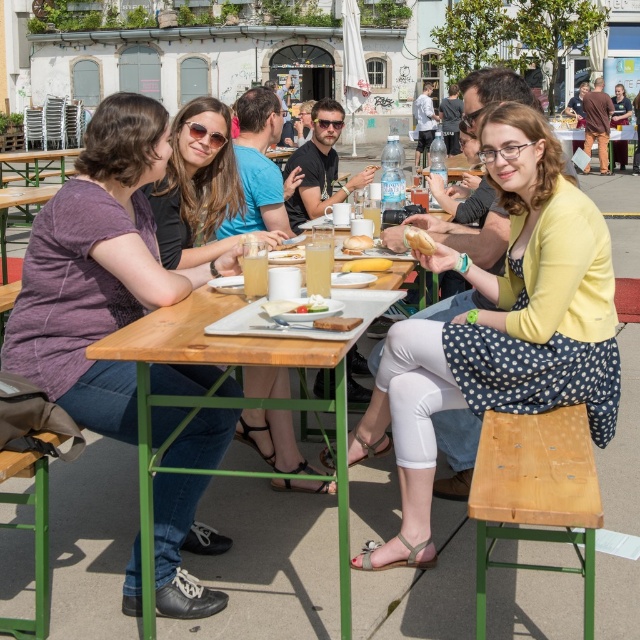
You are a customer at the outdoor dining area and want to grab the golden bread at center and the white glossy plate at center. Which one do you need to reach over first?

The golden bread at center is closer to you than the white glossy plate at center, so you need to reach over the golden bread at center first.

You are standing at the point labeled as point (188, 304) and want to walk to the entrance of the outdoor dining area. There is an obstacle at point (433, 340). Can you safely walk around the obstacle to reach the entrance?

Point (433, 340) is in front of point (188, 304), so you would need to go around it to reach the entrance. However, the exact path isnecessary to determine safety.